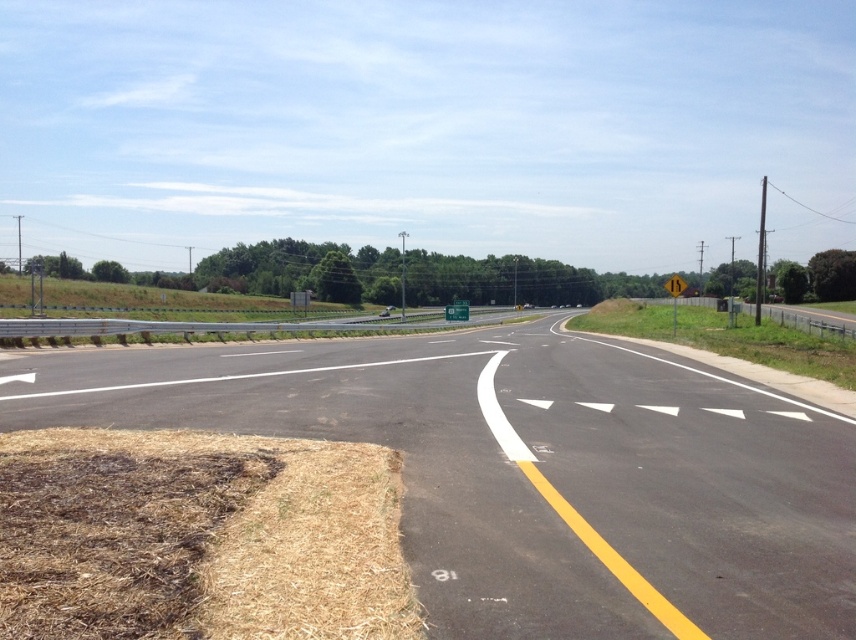
You are a driver approaching the asphalt road at center and the yellow reflective plastic sign at right. Which object takes up more visual space in the image?

The yellow reflective plastic sign at right occupies more visual space than the asphalt road at center in the image.